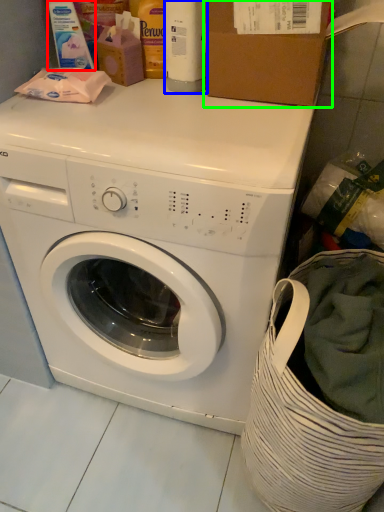
Question: Considering the real-world distances, which object is farthest from cleaning product (highlighted by a red box)? cleaning product (highlighted by a blue box) or cardboard box (highlighted by a green box)?

Choices:
 (A) cleaning product
 (B) cardboard box

Answer: (B)